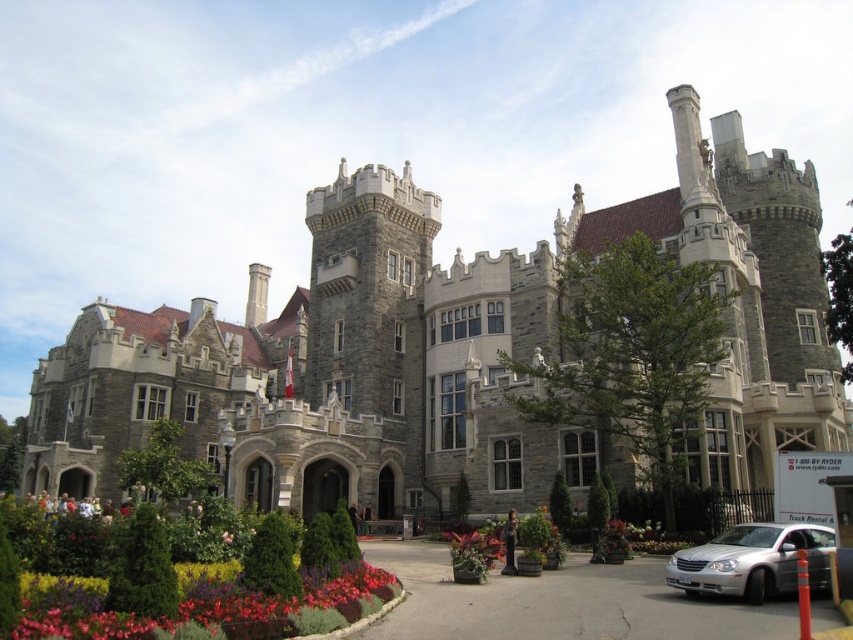
Looking at this image, you are standing in the garden of the castle and want to place a new flower pot. The green textured planter at lower center is located at point [527,564]. Where should you place the new flower pot so that it is directly to the north of the green textured planter at lower center?

To place the new flower pot directly north of the green textured planter at lower center, you should position it at coordinates north of point [527,564]. However, without specific coordinate values for the northern direction, it is recommended to place it in the northern part of the garden relative to the existing planter.

You are standing in the garden in front of the castle. You see the green textured planter at lower center and the pink matte flower at center. Which object is closer to you?

The green textured planter at lower center is closer to you because it is further to the viewer than the pink matte flower at center.